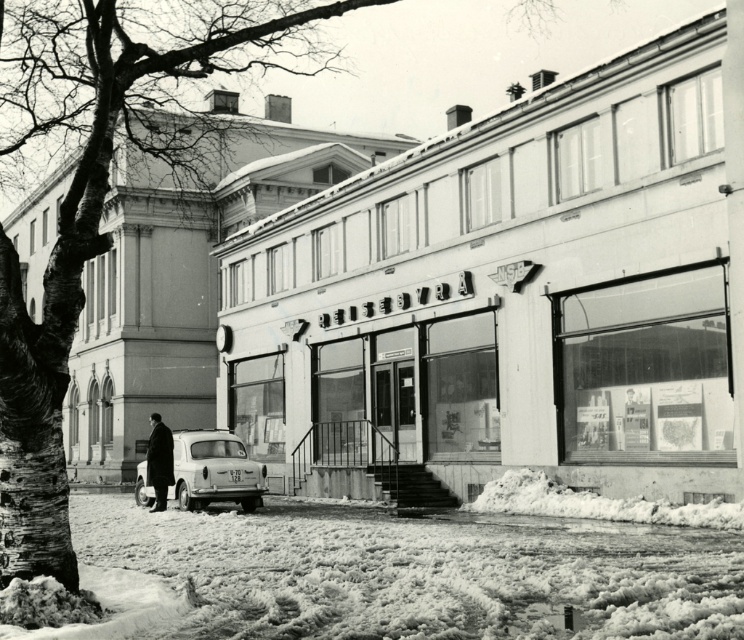
You are a photographer standing in front of the REISEBYR would like to take a picture that includes both the white wood storefront at center and the dark wool coat at center. Based on their sizes, which object will appear larger in the photo?

The white wood storefront at center will appear larger in the photo because it is much taller than the dark wool coat at center.

You are a pedestrian standing on the snowy street in front of the REISEBYR? building. You want to take a photo of the white wood storefront at center without the white matte car at lower center appearing in the frame. Which direction should you move to achieve this?

Move towards the white wood storefront at center to position yourself closer to it, which will allow you to frame the shot without the white matte car at lower center appearing in the background since the storefront is in front of the car.